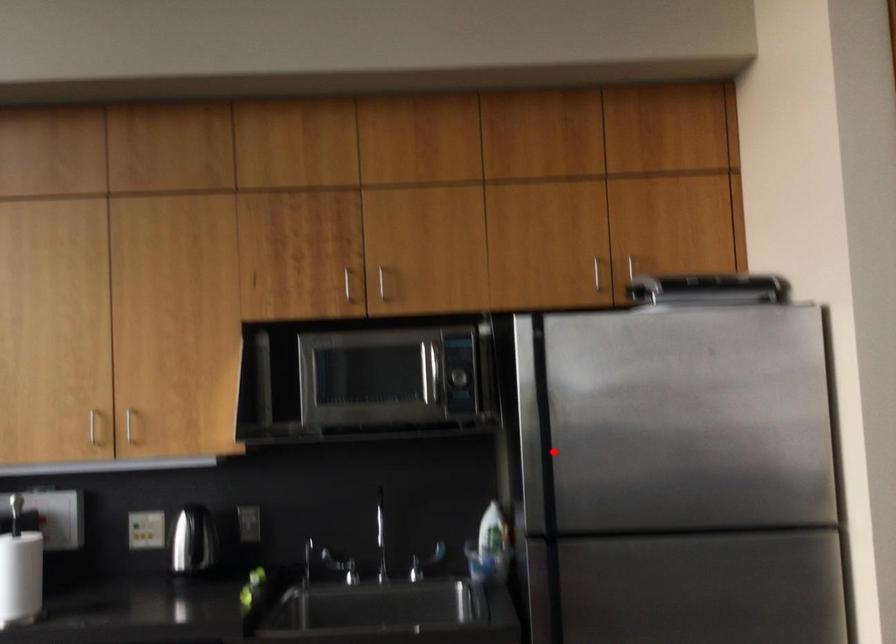
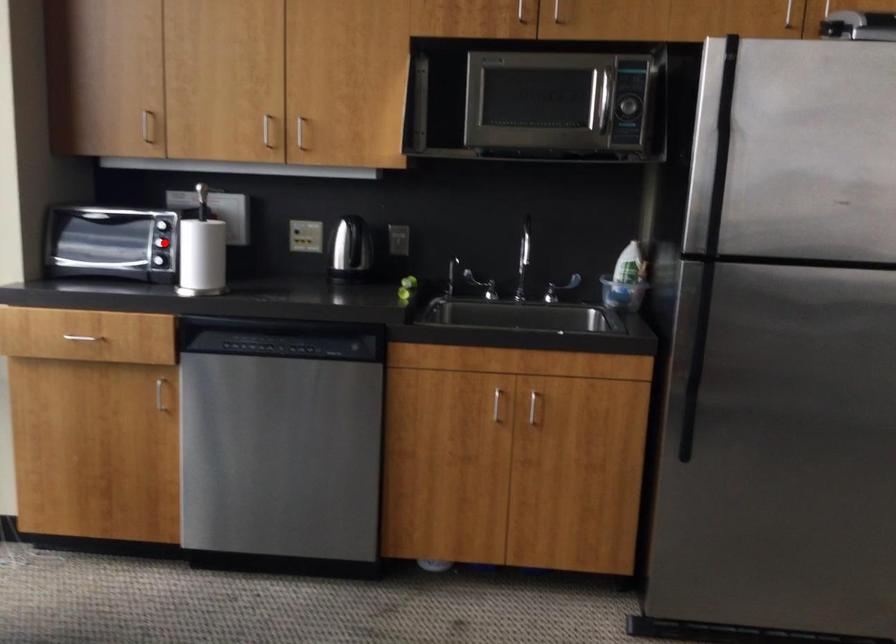
I am providing you with two images of the same scene from different viewpoints. A red point is marked on the first image and another point is marked on the second image. Does the point marked in image1 correspond to the same location as the one in image2?

No